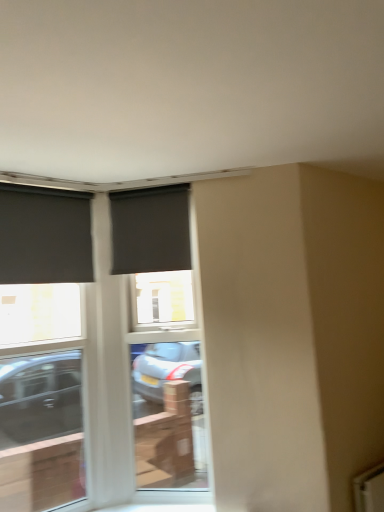
Question: Should I look upward or downward to see matte black roller blind at left, which ranks as the third window in right-to-left order?

Choices:
 (A) up
 (B) down

Answer: (A)

Question: Does matte black window at left, which appears as the 2th window when viewed from the left, appear on the right side of matte black screen door at center?

Choices:
 (A) yes
 (B) no

Answer: (B)

Question: Is matte black window at left, placed as the 2th window when sorted from right to left, at the left side of matte black screen door at center?

Choices:
 (A) no
 (B) yes

Answer: (B)

Question: Would you consider matte black window at left, which appears as the 2th window when viewed from the left, to be distant from matte black screen door at center?

Choices:
 (A) no
 (B) yes

Answer: (B)

Question: Is matte black window at left, placed as the 2th window when sorted from right to left, outside of matte black screen door at center?

Choices:
 (A) no
 (B) yes

Answer: (B)

Question: Can matte black screen door at center be found inside matte black window at left, placed as the 2th window when sorted from right to left?

Choices:
 (A) no
 (B) yes

Answer: (A)

Question: Is matte black window at left, placed as the 2th window when sorted from right to left, behind matte black screen door at center?

Choices:
 (A) yes
 (B) no

Answer: (B)

Question: Would you say matte black roller blind at left, which is counted as the first window, starting from the left, is a long distance from matte black window at left, placed as the 2th window when sorted from right to left?

Choices:
 (A) yes
 (B) no

Answer: (A)

Question: Is matte black roller blind at left, which is counted as the first window, starting from the left, facing towards matte black window at left, which appears as the 2th window when viewed from the left?

Choices:
 (A) no
 (B) yes

Answer: (A)

Question: Is matte black roller blind at left, which ranks as the third window in right-to-left order, positioned with its back to matte black window at left, placed as the 2th window when sorted from right to left?

Choices:
 (A) yes
 (B) no

Answer: (A)

Question: Does matte black roller blind at left, which ranks as the third window in right-to-left order, appear on the left side of matte black window at left, which appears as the 2th window when viewed from the left?

Choices:
 (A) no
 (B) yes

Answer: (B)

Question: Is matte black roller blind at left, which ranks as the third window in right-to-left order, wider than matte black window at left, placed as the 2th window when sorted from right to left?

Choices:
 (A) no
 (B) yes

Answer: (A)

Question: From the image's perspective, is matte black roller blind at left, which is counted as the first window, starting from the left, located above matte black window at left, placed as the 2th window when sorted from right to left?

Choices:
 (A) yes
 (B) no

Answer: (A)

Question: Can you confirm if matte black roller blind at center, which is the 1th window from right to left, is thinner than matte black screen door at center?

Choices:
 (A) no
 (B) yes

Answer: (B)